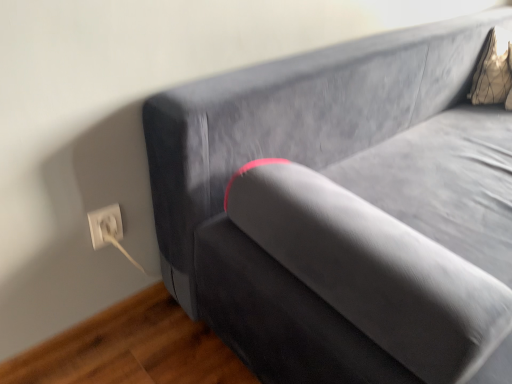
In order to click on gold textured pillow at upper right in this screenshot , I will do `click(493, 69)`.

Describe the element at coordinates (493, 69) in the screenshot. This screenshot has height=384, width=512. I see `gold textured pillow at upper right` at that location.

Based on the photo, measure the distance between gold textured pillow at upper right and camera.

gold textured pillow at upper right is 1.73 meters from camera.

In order to face gold textured pillow at upper right, should I rotate leftwards or rightwards?

Turn right approximately 31.946 degrees to face it.

What are the coordinates of `white plastic electric outlet at lower left` in the screenshot? It's located at (105, 225).

Consider the image. What is the approximate width of white plastic electric outlet at lower left?

It is 0.69 inches.

This screenshot has height=384, width=512. Describe the element at coordinates (105, 225) in the screenshot. I see `white plastic electric outlet at lower left` at that location.

Locate an element on the screen. gold textured pillow at upper right is located at coordinates (493, 69).

Can you confirm if white plastic electric outlet at lower left is positioned to the right of gold textured pillow at upper right?

No, white plastic electric outlet at lower left is not to the right of gold textured pillow at upper right.

In the image, is white plastic electric outlet at lower left positioned in front of or behind gold textured pillow at upper right?

white plastic electric outlet at lower left is in front of gold textured pillow at upper right.

Is point (98, 224) farther from camera compared to point (483, 72)?

No, (98, 224) is closer to viewer.

From the image's perspective, is white plastic electric outlet at lower left positioned above or below gold textured pillow at upper right?

Based on their image positions, white plastic electric outlet at lower left is located beneath gold textured pillow at upper right.

From a real-world perspective, relative to gold textured pillow at upper right, is white plastic electric outlet at lower left vertically above or below?

white plastic electric outlet at lower left is below gold textured pillow at upper right.

From the picture: Is white plastic electric outlet at lower left wider or thinner than gold textured pillow at upper right?

Clearly, white plastic electric outlet at lower left has less width compared to gold textured pillow at upper right.

Can you confirm if white plastic electric outlet at lower left is shorter than gold textured pillow at upper right?

Indeed, white plastic electric outlet at lower left has a lesser height compared to gold textured pillow at upper right.

Does white plastic electric outlet at lower left have a smaller size compared to gold textured pillow at upper right?

Correct, white plastic electric outlet at lower left occupies less space than gold textured pillow at upper right.

Is white plastic electric outlet at lower left outside of gold textured pillow at upper right?

Yes, white plastic electric outlet at lower left is not within gold textured pillow at upper right.

Looking at this image, would you consider white plastic electric outlet at lower left to be distant from gold textured pillow at upper right?

white plastic electric outlet at lower left is positioned a significant distance from gold textured pillow at upper right.

Is white plastic electric outlet at lower left positioned with its back to gold textured pillow at upper right?

No.

What's the angular difference between white plastic electric outlet at lower left and gold textured pillow at upper right's facing directions?

They differ by 46 degrees in their facing directions.

How distant is white plastic electric outlet at lower left from gold textured pillow at upper right?

white plastic electric outlet at lower left is 5.17 feet from gold textured pillow at upper right.

In order to click on electric outlet on the left of gold textured pillow at upper right in this screenshot , I will do `click(105, 225)`.

Considering the relative positions of gold textured pillow at upper right and white plastic electric outlet at lower left in the image provided, is gold textured pillow at upper right to the right of white plastic electric outlet at lower left from the viewer's perspective?

Yes, gold textured pillow at upper right is to the right of white plastic electric outlet at lower left.

In the image, is gold textured pillow at upper right positioned in front of or behind white plastic electric outlet at lower left?

In the image, gold textured pillow at upper right appears behind white plastic electric outlet at lower left.

Is point (496, 55) in front of point (119, 211)?

No, (496, 55) is further to viewer.

From the image's perspective, between gold textured pillow at upper right and white plastic electric outlet at lower left, who is located below?

white plastic electric outlet at lower left appears lower in the image.

From a real-world perspective, between gold textured pillow at upper right and white plastic electric outlet at lower left, who is vertically higher?

In real-world perspective, gold textured pillow at upper right is above.

Does gold textured pillow at upper right have a lesser width compared to white plastic electric outlet at lower left?

In fact, gold textured pillow at upper right might be wider than white plastic electric outlet at lower left.

Which of these two, gold textured pillow at upper right or white plastic electric outlet at lower left, stands shorter?

With less height is white plastic electric outlet at lower left.

In the scene shown: Considering the relative sizes of gold textured pillow at upper right and white plastic electric outlet at lower left in the image provided, is gold textured pillow at upper right smaller than white plastic electric outlet at lower left?

Actually, gold textured pillow at upper right might be larger than white plastic electric outlet at lower left.

Based on the photo, is gold textured pillow at upper right inside or outside of white plastic electric outlet at lower left?

gold textured pillow at upper right is not enclosed by white plastic electric outlet at lower left.

Is gold textured pillow at upper right not close to white plastic electric outlet at lower left?

Indeed, gold textured pillow at upper right is not near white plastic electric outlet at lower left.

Could you tell me if gold textured pillow at upper right is turned towards white plastic electric outlet at lower left?

No, gold textured pillow at upper right is not oriented towards white plastic electric outlet at lower left.

How different are the orientations of gold textured pillow at upper right and white plastic electric outlet at lower left in degrees?

gold textured pillow at upper right and white plastic electric outlet at lower left are facing 46 degrees away from each other.

How far apart are gold textured pillow at upper right and white plastic electric outlet at lower left?

gold textured pillow at upper right is 1.58 meters from white plastic electric outlet at lower left.

The width and height of the screenshot is (512, 384). Identify the location of pillow lying on the right of white plastic electric outlet at lower left. (493, 69).

Where is `electric outlet that is in front of the gold textured pillow at upper right`? The image size is (512, 384). electric outlet that is in front of the gold textured pillow at upper right is located at coordinates (105, 225).

You are a GUI agent. You are given a task and a screenshot of the screen. Output one action in this format:
    pyautogui.click(x=<x>, y=<y>)
    Task: Click on the pillow to the right of white plastic electric outlet at lower left
    
    Given the screenshot: What is the action you would take?
    pyautogui.click(x=493, y=69)